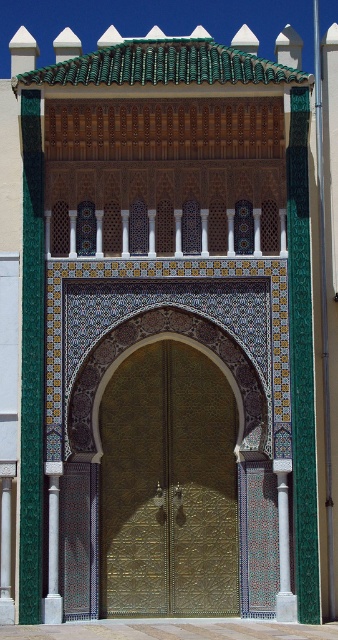
Does gold textured door at center have a smaller size compared to green stone column at left?

Actually, gold textured door at center might be larger than green stone column at left.

Does gold textured door at center have a lesser height compared to green stone column at left?

Incorrect, gold textured door at center's height does not fall short of green stone column at left's.

Which is in front, point (156, 461) or point (52, 588)?

Positioned in front is point (52, 588).

The image size is (338, 640). Identify the location of gold textured door at center. (167, 486).

Looking at this image, who is lower down, white marble column at center or green stone column at left?

Positioned lower is white marble column at center.

Which of these two, white marble column at center or green stone column at left, stands shorter?

white marble column at center is shorter.

Locate an element on the screen. white marble column at center is located at coordinates (283, 545).

Between gold textured door at center and white marble column at center, which one is positioned lower?

Positioned lower is white marble column at center.

Can you confirm if gold textured door at center is thinner than white marble column at center?

Incorrect, gold textured door at center's width is not less than white marble column at center's.

At what (x,y) coordinates should I click in order to perform the action: click on gold textured door at center. Please return your answer as a coordinate pair (x, y). This screenshot has width=338, height=640. Looking at the image, I should click on (167, 486).